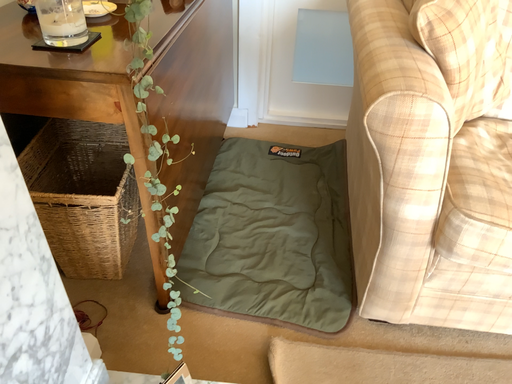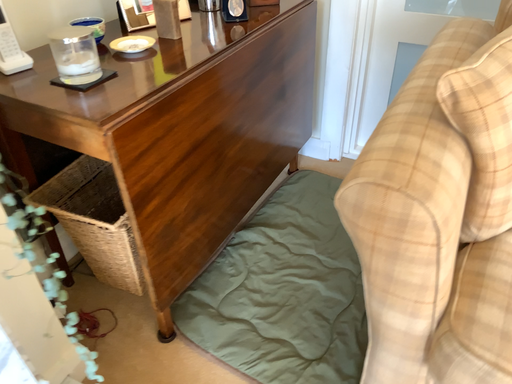
Question: How did the camera likely rotate when shooting the video?

Choices:
 (A) rotated left
 (B) rotated right

Answer: (A)